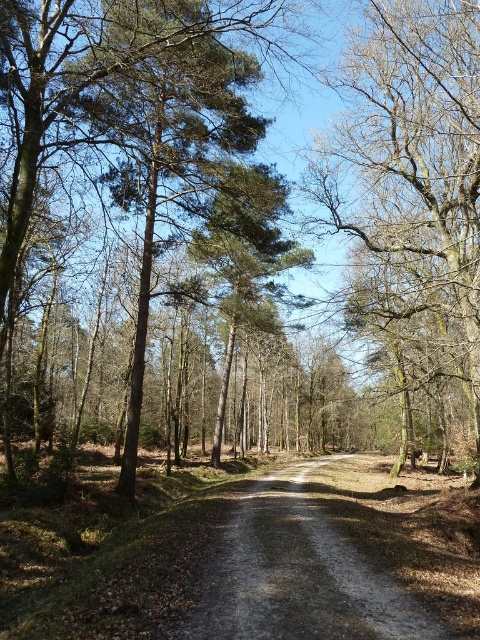
Question: Which point is farther to the camera?

Choices:
 (A) dirt/gravel trail at center
 (B) bare wood tree at center

Answer: (B)

Question: Which object appears closest to the camera in this image?

Choices:
 (A) bare wood tree at center
 (B) dirt/gravel trail at center

Answer: (B)

Question: Can you confirm if bare wood tree at center is wider than dirt/gravel trail at center?

Choices:
 (A) no
 (B) yes

Answer: (B)

Question: Can you confirm if bare wood tree at center is positioned above dirt/gravel trail at center?

Choices:
 (A) yes
 (B) no

Answer: (A)

Question: Can you confirm if bare wood tree at center is bigger than dirt/gravel trail at center?

Choices:
 (A) yes
 (B) no

Answer: (A)

Question: Which of the following is the closest to the observer?

Choices:
 (A) bare wood tree at center
 (B) dirt/gravel trail at center

Answer: (B)